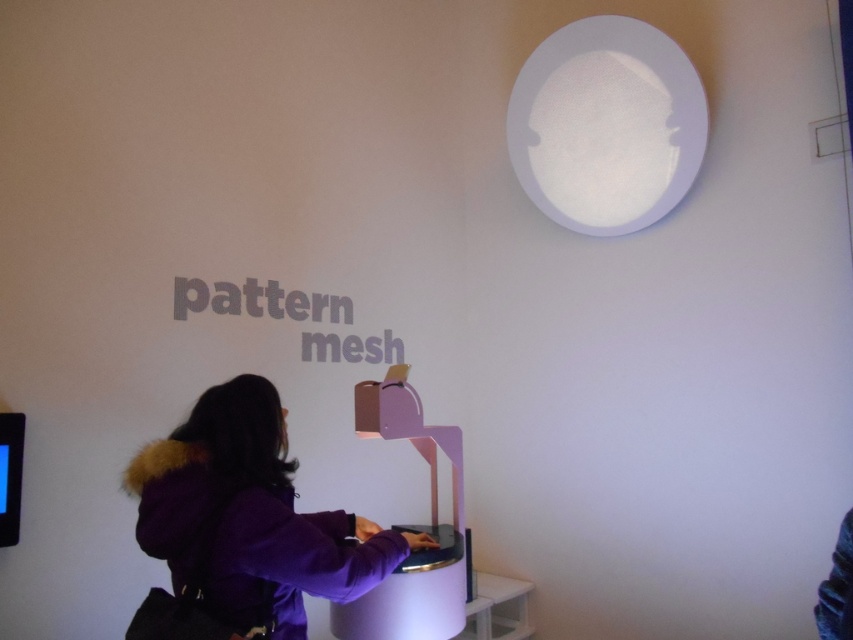
Question: Which object is the farthest from the white plastic stool at lower center?

Choices:
 (A) dark purple fabric at lower right
 (B) purple fabric coat at center

Answer: (A)

Question: Based on their relative distances, which object is farther from the white plastic stool at lower center?

Choices:
 (A) purple fabric coat at center
 (B) dark purple fabric at lower right

Answer: (B)

Question: Does purple fabric coat at center appear under white plastic stool at lower center?

Choices:
 (A) no
 (B) yes

Answer: (A)

Question: Estimate the real-world distances between objects in this image. Which object is farther from the dark purple fabric at lower right?

Choices:
 (A) white plastic stool at lower center
 (B) purple fabric coat at center

Answer: (A)

Question: Does white plastic stool at lower center come behind dark purple fabric at lower right?

Choices:
 (A) yes
 (B) no

Answer: (A)

Question: Where is white plastic stool at lower center located in relation to dark purple fabric at lower right in the image?

Choices:
 (A) above
 (B) below

Answer: (B)